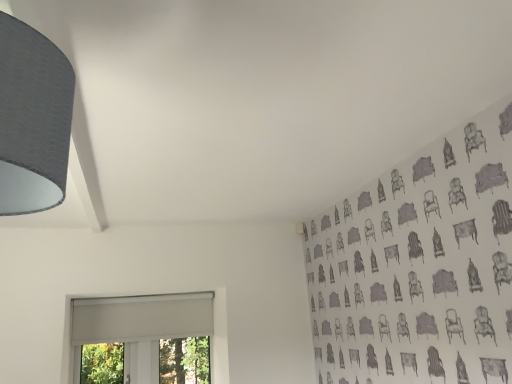
Question: Is matte gray lampshade at upper left outside white matte window at lower left?

Choices:
 (A) yes
 (B) no

Answer: (A)

Question: Considering the relative sizes of matte gray lampshade at upper left and white matte window at lower left in the image provided, is matte gray lampshade at upper left taller than white matte window at lower left?

Choices:
 (A) no
 (B) yes

Answer: (A)

Question: From the image's perspective, is matte gray lampshade at upper left below white matte window at lower left?

Choices:
 (A) no
 (B) yes

Answer: (A)

Question: From the image's perspective, is matte gray lampshade at upper left on top of white matte window at lower left?

Choices:
 (A) no
 (B) yes

Answer: (B)

Question: Does matte gray lampshade at upper left appear on the left side of white matte window at lower left?

Choices:
 (A) yes
 (B) no

Answer: (B)

Question: Considering the relative positions of matte gray lampshade at upper left and white matte window at lower left in the image provided, is matte gray lampshade at upper left behind white matte window at lower left?

Choices:
 (A) yes
 (B) no

Answer: (B)

Question: Does white matte window at lower left have a larger size compared to matte gray lampshade at upper left?

Choices:
 (A) yes
 (B) no

Answer: (A)

Question: Is white matte window at lower left far away from matte gray lampshade at upper left?

Choices:
 (A) no
 (B) yes

Answer: (B)

Question: Considering the relative positions of white matte window at lower left and matte gray lampshade at upper left in the image provided, is white matte window at lower left behind matte gray lampshade at upper left?

Choices:
 (A) yes
 (B) no

Answer: (A)

Question: From the image's perspective, is white matte window at lower left beneath matte gray lampshade at upper left?

Choices:
 (A) no
 (B) yes

Answer: (B)

Question: Is white matte window at lower left to the left of matte gray lampshade at upper left from the viewer's perspective?

Choices:
 (A) yes
 (B) no

Answer: (A)

Question: Is matte gray lampshade at upper left completely or partially inside white matte window at lower left?

Choices:
 (A) no
 (B) yes

Answer: (A)

Question: In terms of height, does matte gray lampshade at upper left look taller or shorter compared to white matte window at lower left?

Choices:
 (A) tall
 (B) short

Answer: (B)